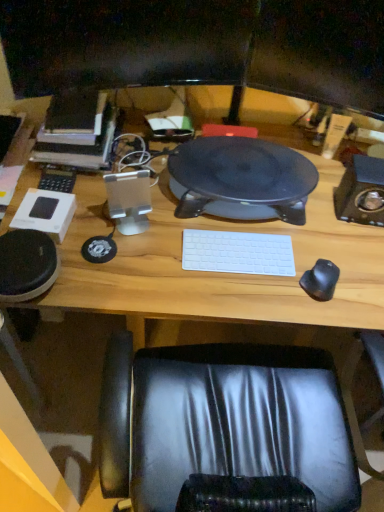
Where is `vacant area that lies between black rubber mouse at right and white matte keyboard at center`? vacant area that lies between black rubber mouse at right and white matte keyboard at center is located at coordinates (272, 278).